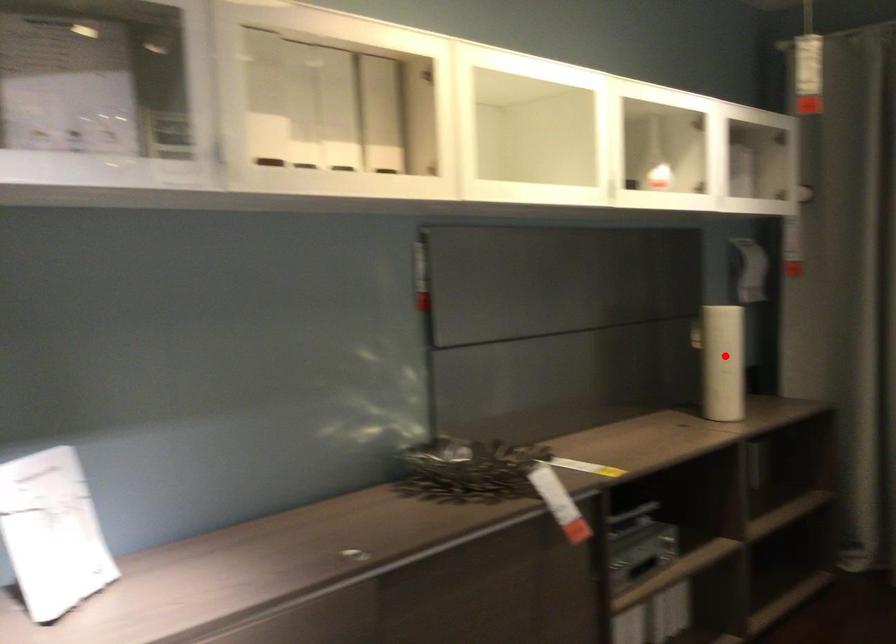
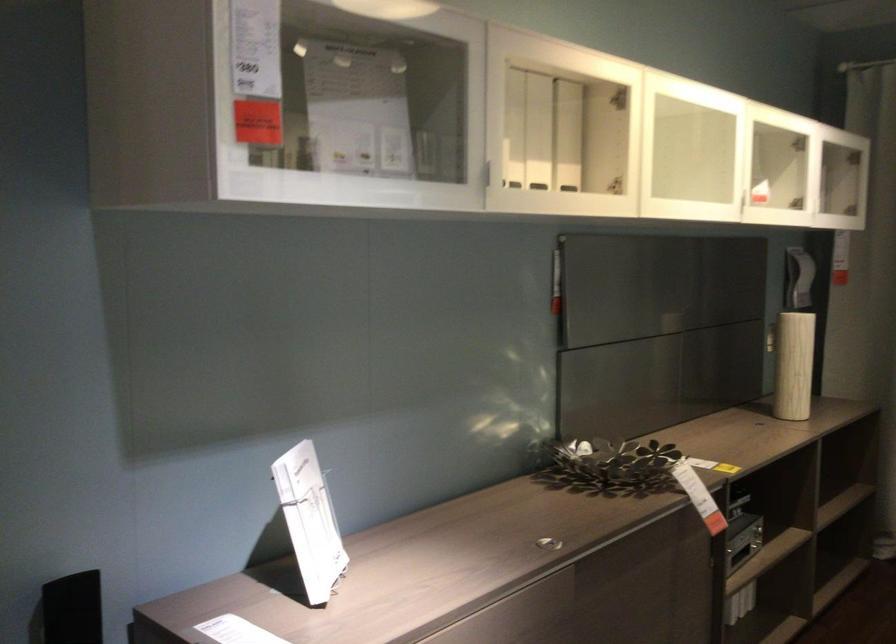
Locate, in the second image, the point that corresponds to the highlighted location in the first image.

(794, 365)